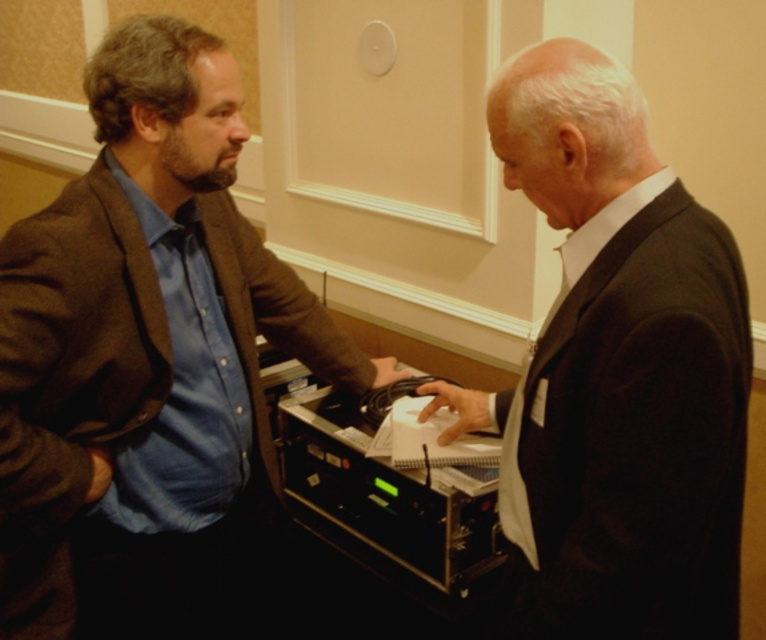
You are standing at the point with coordinates point (x=67, y=355) and want to walk to point (x=565, y=369). Is there a clear path between these two points?

The point (x=67, y=355) is behind point (x=565, y=369), so there is a clear path between them.

You are standing 1.5 meters away from the camera. Can you reach the point at coordinates (69, 412) without moving your feet?

The point at coordinates (69, 412) is 1.20 meters away from the camera. Since you are 1.5 meters away from the camera, you are farther than the point. Therefore, you cannot reach it without moving closer.